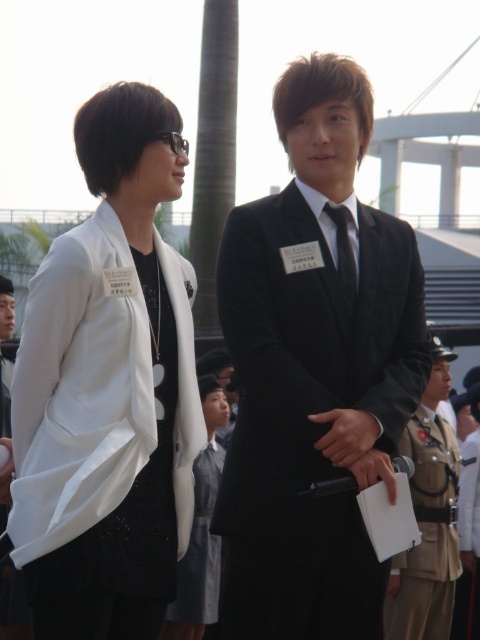
Question: Does khaki uniform at lower right appear under black satin tie at center?

Choices:
 (A) yes
 (B) no

Answer: (A)

Question: Does black velvet suit at center appear on the right side of khaki uniform at lower right?

Choices:
 (A) yes
 (B) no

Answer: (B)

Question: Among these points, which one is nearest to the camera?

Choices:
 (A) (95, 400)
 (B) (444, 624)

Answer: (A)

Question: Is khaki uniform at lower right above black satin tie at center?

Choices:
 (A) yes
 (B) no

Answer: (B)

Question: Which object is farther from the camera taking this photo?

Choices:
 (A) white matte blazer at left
 (B) black velvet suit at center
 (C) khaki uniform at lower right
 (D) black satin tie at center

Answer: (C)

Question: Which of these objects is positioned closest to the white matte blazer at left?

Choices:
 (A) black velvet suit at center
 (B) khaki uniform at lower right

Answer: (A)